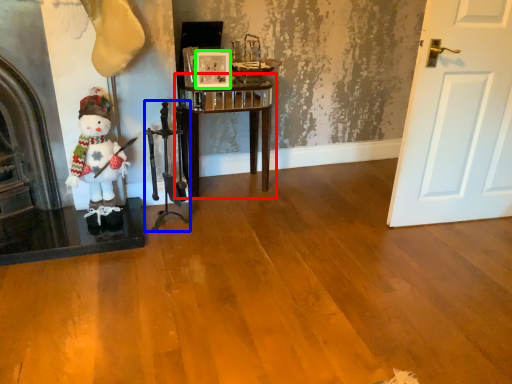
Question: Estimate the real-world distances between objects in this image. Which object is closer to furniture (highlighted by a red box), chair (highlighted by a blue box) or picture frame (highlighted by a green box)?

Choices:
 (A) chair
 (B) picture frame

Answer: (B)